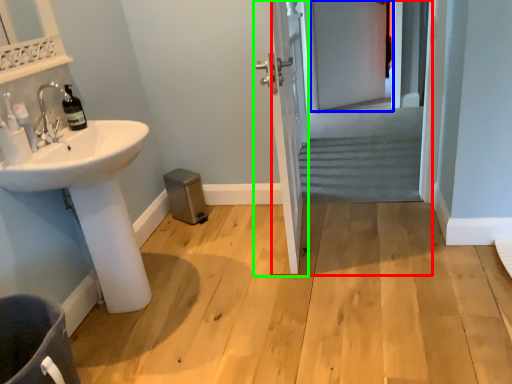
Question: Based on their relative distances, which object is farther from screen door (highlighted by a red box)? Choose from screen door (highlighted by a blue box) and door (highlighted by a green box).

Choices:
 (A) screen door
 (B) door

Answer: (B)